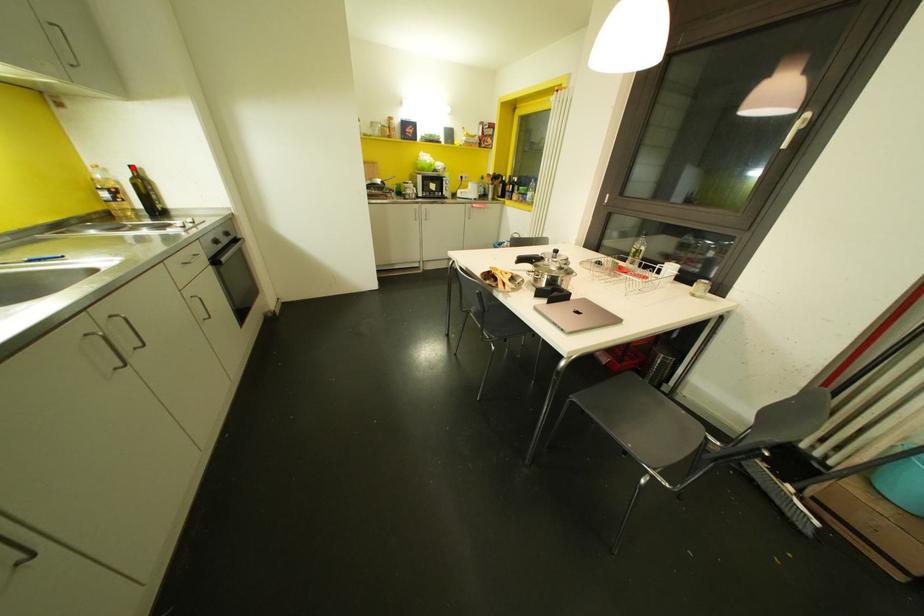
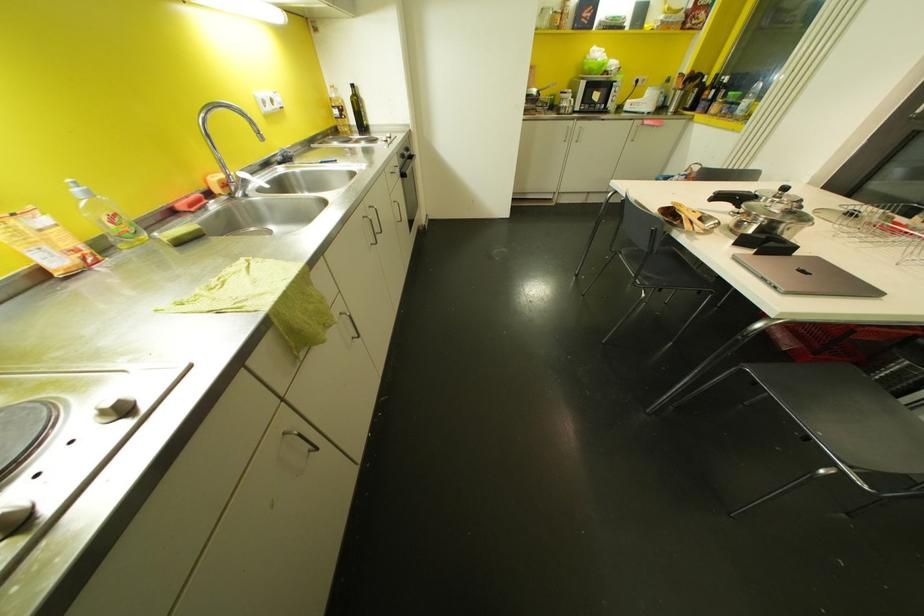
Question: I am providing you with two images of the same scene from different viewpoints. In image1, a red point is highlighted. Considering the same 3D point in image2, which of the following is correct?

Choices:
 (A) It is closer
 (B) It is farther

Answer: (A)